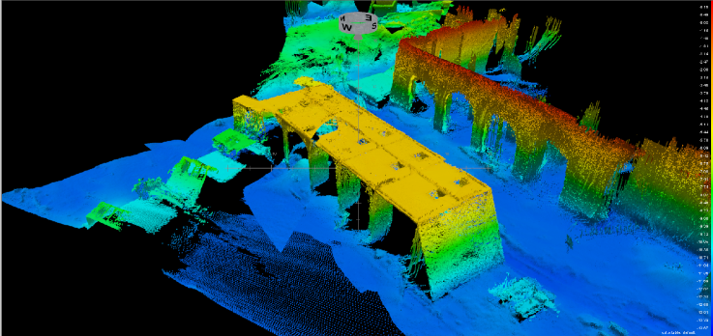
Locate an element on the screen. archway is located at coordinates (550, 167), (507, 143), (456, 117), (424, 96).